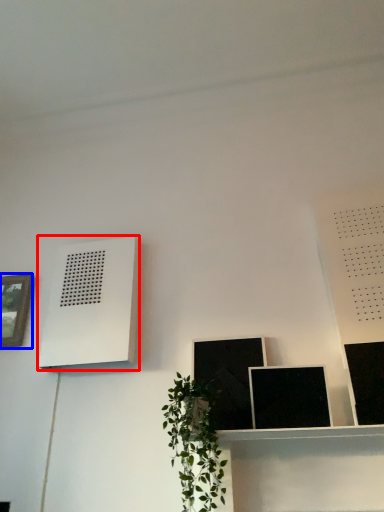
Question: Which point is further to the camera, air conditioner (highlighted by a red box) or picture frame (highlighted by a blue box)?

Choices:
 (A) air conditioner
 (B) picture frame

Answer: (B)